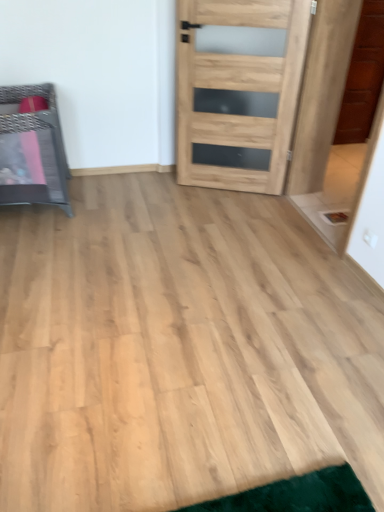
Locate an element on the screen. This screenshot has width=384, height=512. vacant space to the right of metallic woven basket at left is located at coordinates (116, 208).